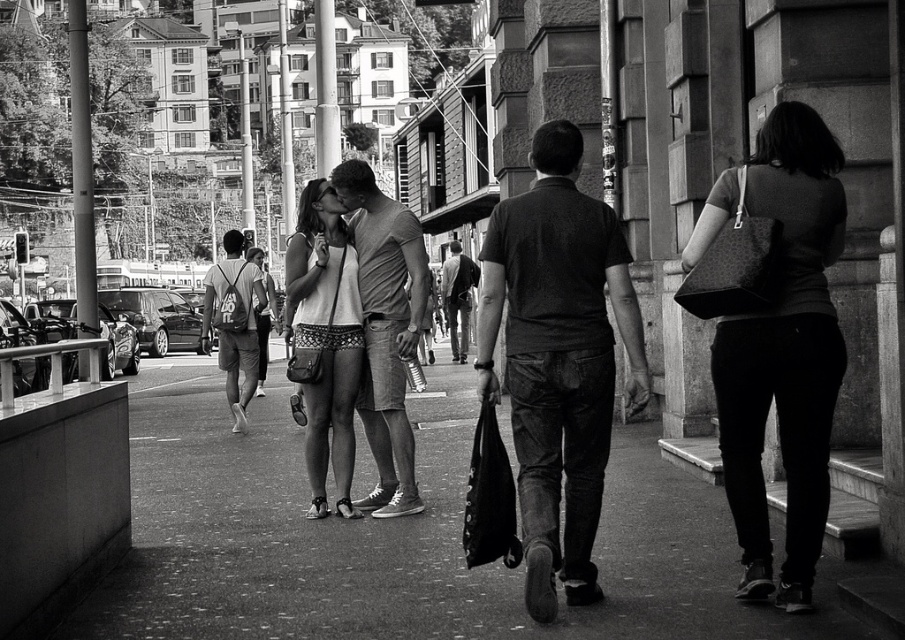
Can you confirm if matte gray backpack at center is smaller than matte gray shirt at center?

No, matte gray backpack at center is not smaller than matte gray shirt at center.

Describe the element at coordinates (234, 321) in the screenshot. The height and width of the screenshot is (640, 905). I see `matte gray backpack at center` at that location.

Which is in front, point (205, 316) or point (468, 282)?

Positioned in front is point (205, 316).

Identify the location of matte gray backpack at center. This screenshot has width=905, height=640. point(234,321).

Locate an element on the screen. matte white tank top at center is located at coordinates (325, 339).

Which is in front, point (294, 323) or point (464, 355)?

Positioned in front is point (294, 323).

Identify the location of matte white tank top at center. This screenshot has width=905, height=640. (325, 339).

From the picture: Which of these two, matte black bag at center or matte gray backpack at center, stands shorter?

With less height is matte gray backpack at center.

Does matte black bag at center have a greater height compared to matte gray backpack at center?

Yes.

At what (x,y) coordinates should I click in order to perform the action: click on matte black bag at center. Please return your answer as a coordinate pair (x, y). Looking at the image, I should click on (773, 336).